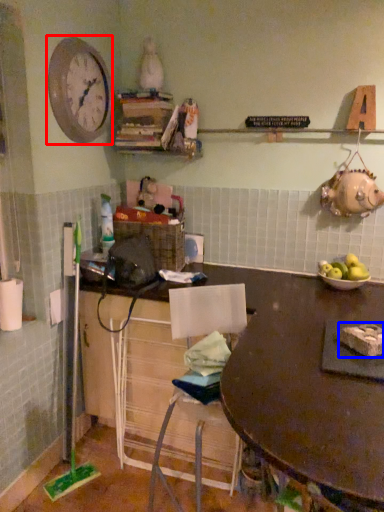
Question: Which point is closer to the camera, clock (highlighted by a red box) or food (highlighted by a blue box)?

Choices:
 (A) clock
 (B) food

Answer: (B)